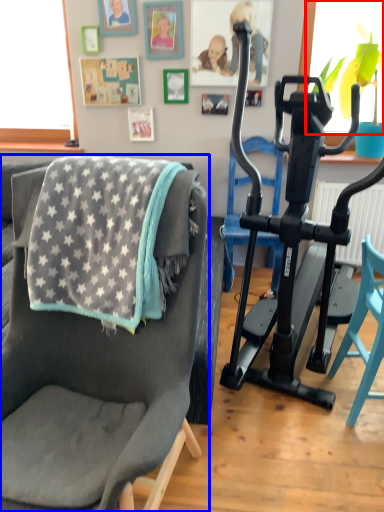
Question: Which of the following is the closest to the observer, window screen (highlighted by a red box) or chair (highlighted by a blue box)?

Choices:
 (A) window screen
 (B) chair

Answer: (B)